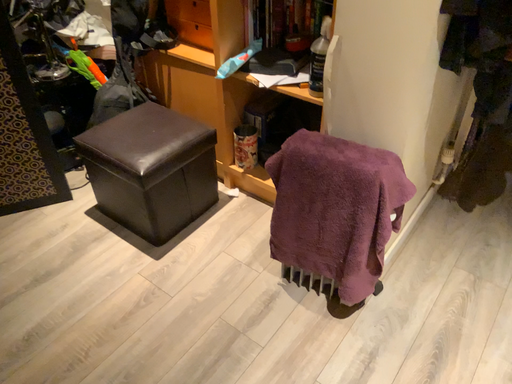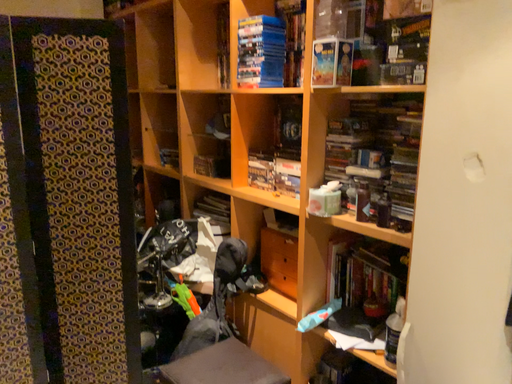
Question: How did the camera likely rotate when shooting the video?

Choices:
 (A) rotated right
 (B) rotated left

Answer: (B)